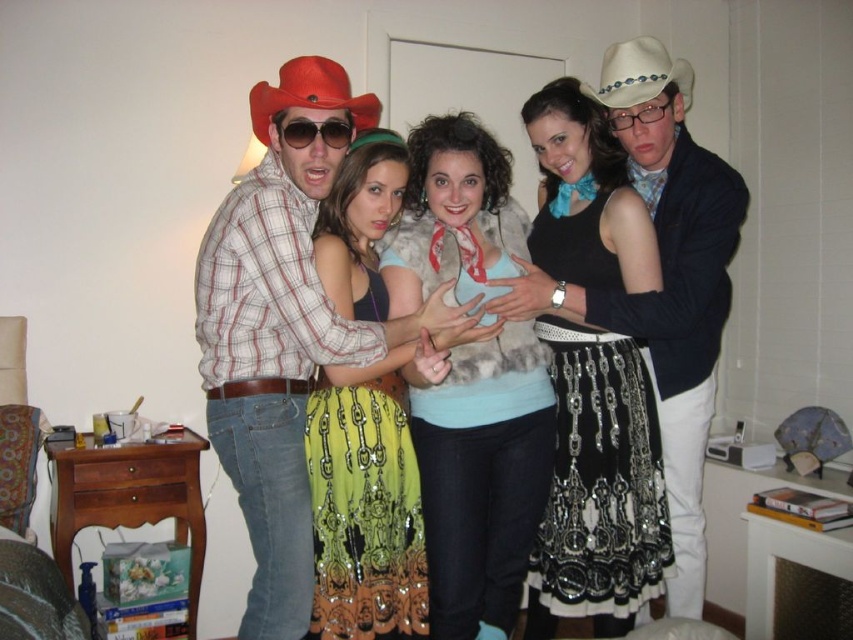
You are a photographer adjusting the lighting in the scene. You notice the matte plaid shirt at center and the black plastic glasses at center. Which object is closer to the camera?

The matte plaid shirt at center is positioned under the black plastic glasses at center, so the black plastic glasses at center is closer to the camera.

You are a photographer trying to capture a clear shot of the black sequined skirt at center and the sunglasses at center. Which object is blocking the view of the other?

The sunglasses at center is behind the black sequined skirt at center, so the black sequined skirt at center is blocking the view of the sunglasses at center.